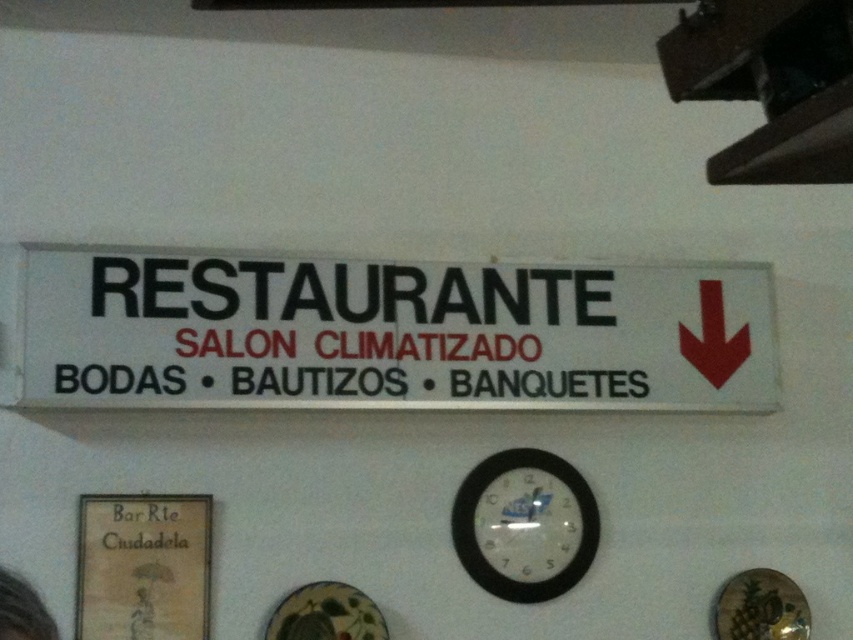
Is white plastic sign at center taller than matte paper sign at center?

Yes.

Is white plastic sign at center smaller than matte paper sign at center?

No, white plastic sign at center is not smaller than matte paper sign at center.

Who is more forward, (28,362) or (131,579)?

Point (28,362)

The width and height of the screenshot is (853, 640). I want to click on white plastic sign at center, so click(x=386, y=333).

Is white plastic sign at center positioned at the back of black plastic clock at center?

No, white plastic sign at center is in front of black plastic clock at center.

Does point (300, 381) lie in front of point (587, 561)?

Yes, point (300, 381) is in front of point (587, 561).

Find the location of `white plastic sign at center`. white plastic sign at center is located at coordinates (386, 333).

How much distance is there between matte paper sign at center and black plastic clock at center?

matte paper sign at center is 23.61 inches away from black plastic clock at center.

Is point (111, 544) farther from viewer compared to point (474, 560)?

No, (111, 544) is closer to viewer.

Is point (113, 637) in front of point (497, 508)?

Yes, point (113, 637) is closer to viewer.

In order to click on matte paper sign at center in this screenshot , I will do `click(143, 566)`.